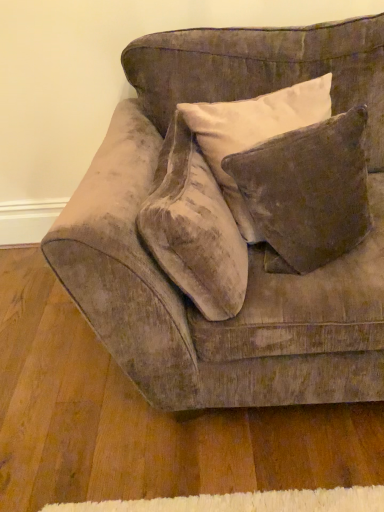
Question: Is velvet brown pillow at upper right far from velvet couch at center?

Choices:
 (A) no
 (B) yes

Answer: (A)

Question: From a real-world perspective, is velvet brown pillow at upper right located higher than velvet couch at center?

Choices:
 (A) no
 (B) yes

Answer: (B)

Question: From the image's perspective, is velvet brown pillow at upper right beneath velvet couch at center?

Choices:
 (A) no
 (B) yes

Answer: (A)

Question: Is velvet brown pillow at upper right positioned behind velvet couch at center?

Choices:
 (A) no
 (B) yes

Answer: (B)

Question: Can you confirm if velvet brown pillow at upper right is positioned to the left of velvet couch at center?

Choices:
 (A) no
 (B) yes

Answer: (A)

Question: From a real-world perspective, does velvet brown pillow at upper right sit lower than velvet couch at center?

Choices:
 (A) no
 (B) yes

Answer: (A)

Question: Would you say velvet beige throw pillow at center is a long distance from velvet couch at center?

Choices:
 (A) yes
 (B) no

Answer: (B)

Question: Is velvet beige throw pillow at center surrounding velvet couch at center?

Choices:
 (A) no
 (B) yes

Answer: (A)

Question: Is velvet beige throw pillow at center outside of velvet couch at center?

Choices:
 (A) no
 (B) yes

Answer: (A)

Question: Is velvet beige throw pillow at center to the left of velvet couch at center from the viewer's perspective?

Choices:
 (A) yes
 (B) no

Answer: (A)

Question: Does velvet beige throw pillow at center have a greater height compared to velvet couch at center?

Choices:
 (A) no
 (B) yes

Answer: (A)

Question: Is velvet beige throw pillow at center oriented away from velvet couch at center?

Choices:
 (A) no
 (B) yes

Answer: (B)

Question: From a real-world perspective, is velvet couch at center over velvet brown pillow at upper right?

Choices:
 (A) yes
 (B) no

Answer: (B)